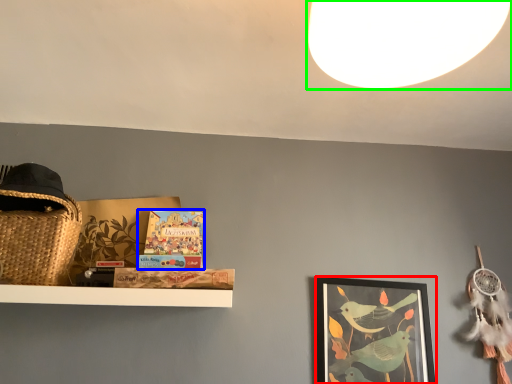
Question: Which object is the farthest from picture frame (highlighted by a red box)? Choose among these: book (highlighted by a blue box) or light (highlighted by a green box).

Choices:
 (A) book
 (B) light

Answer: (B)